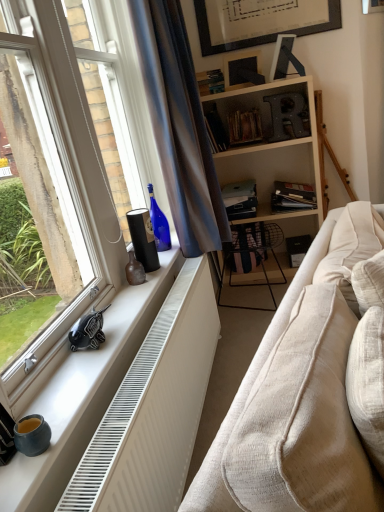
Where is `vacant region in front of brown matte vase at window sill`? This screenshot has height=512, width=384. vacant region in front of brown matte vase at window sill is located at coordinates (130, 296).